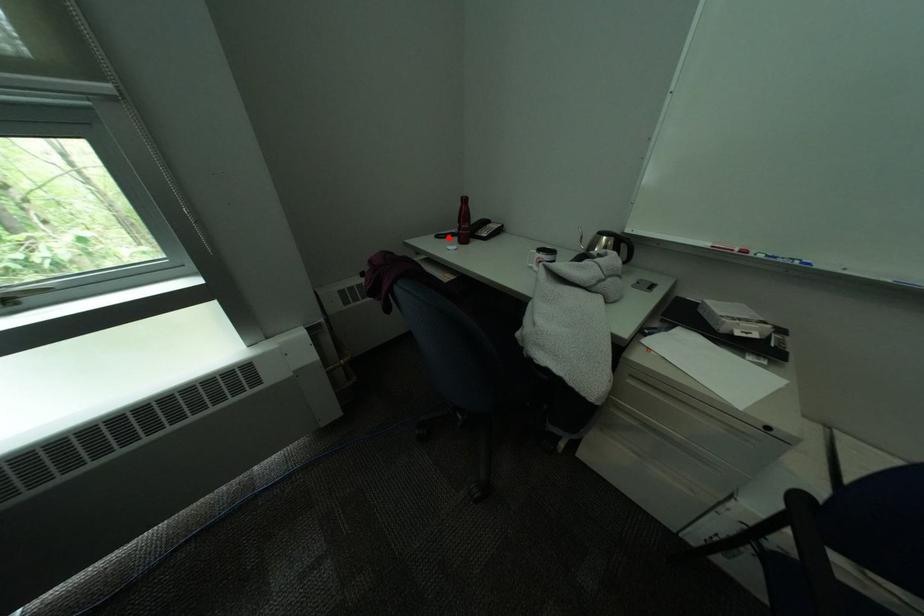
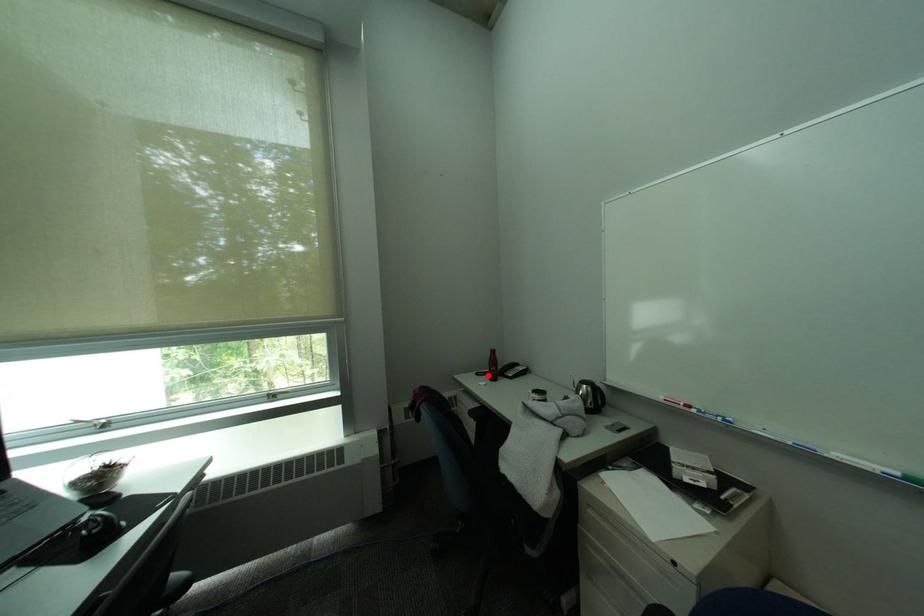
I am providing you with two images of the same scene from different viewpoints. A red point is marked on the first image and another point is marked on the second image. Does the point marked in image1 correspond to the same location as the one in image2?

Yes